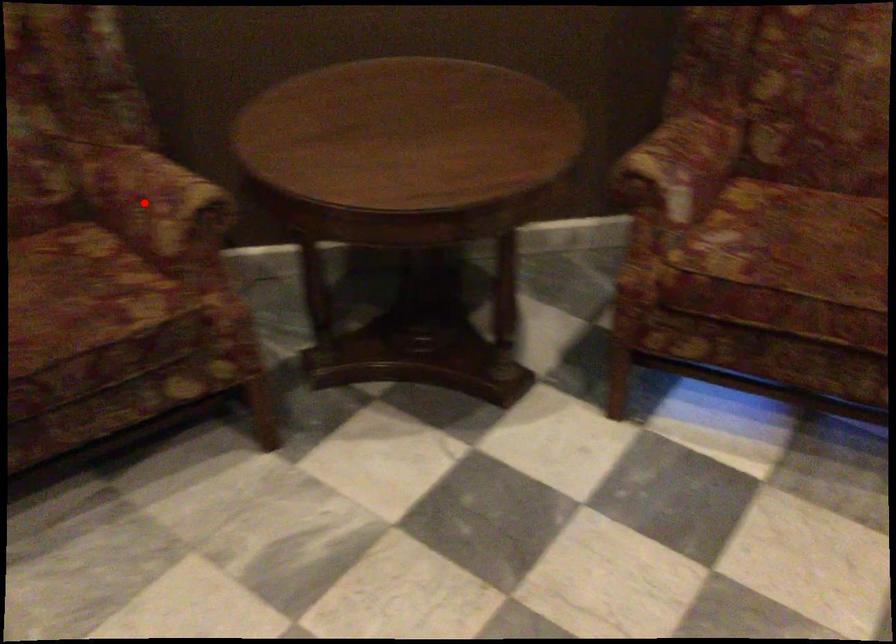
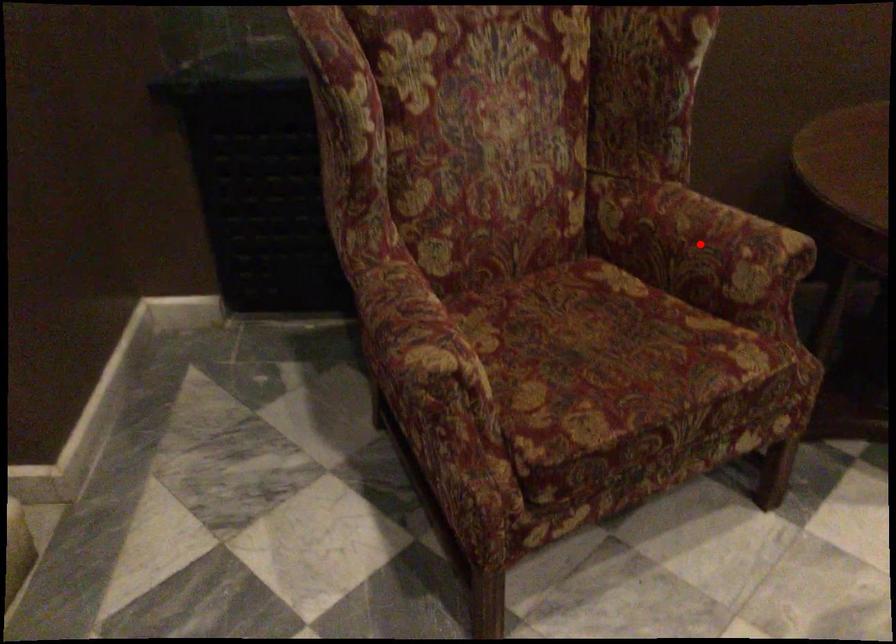
From the picture: I am providing you with two images of the same scene from different viewpoints. A red point is marked on the first image and another point is marked on the second image. Are the points marked in image1 and image2 representing the same 3D position?

Yes